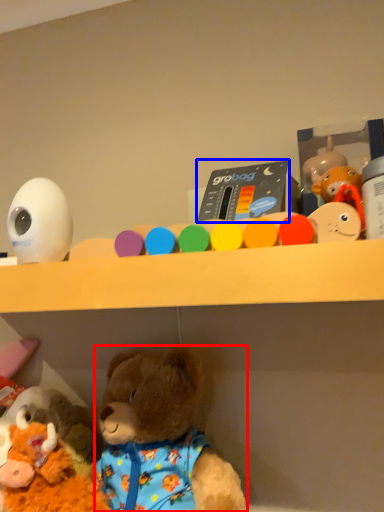
Question: Which of the following is the farthest to the observer, teddy bear (highlighted by a red box) or toy (highlighted by a blue box)?

Choices:
 (A) teddy bear
 (B) toy

Answer: (B)